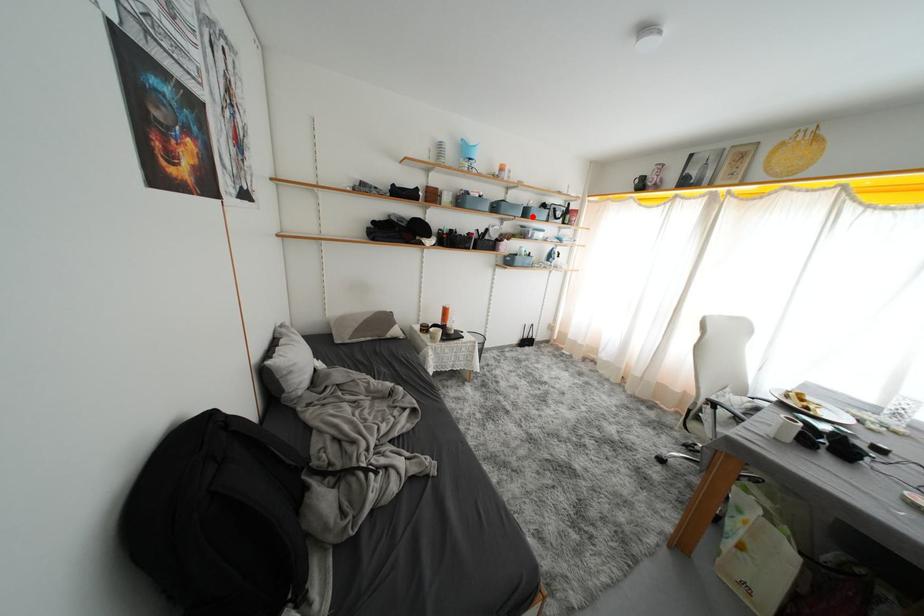
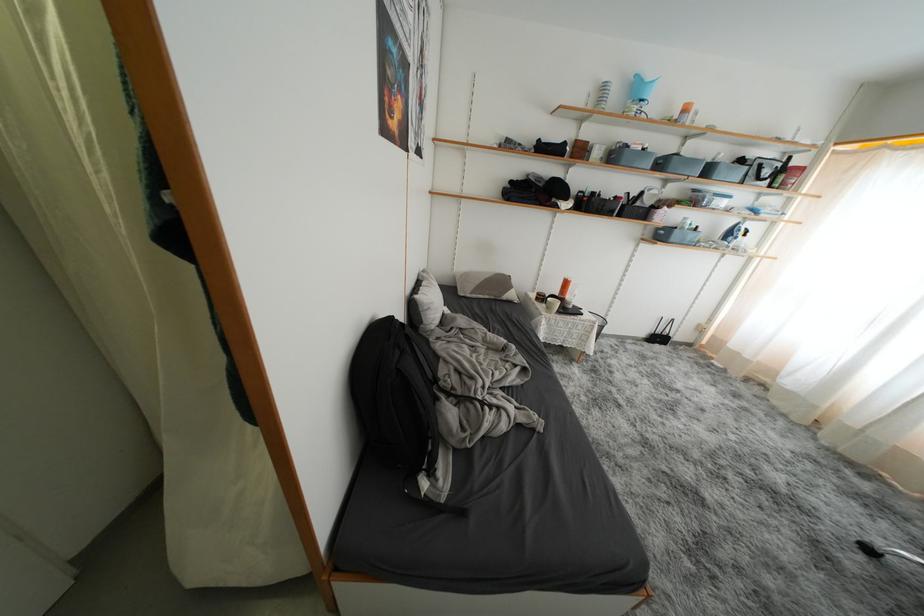
Question: A red point is marked in image1. In image2, is the corresponding 3D point closer to the camera or farther? Reply with the corresponding letter.

Choices:
 (A) The corresponding 3D point is closer.
 (B) The corresponding 3D point is farther.

Answer: (B)